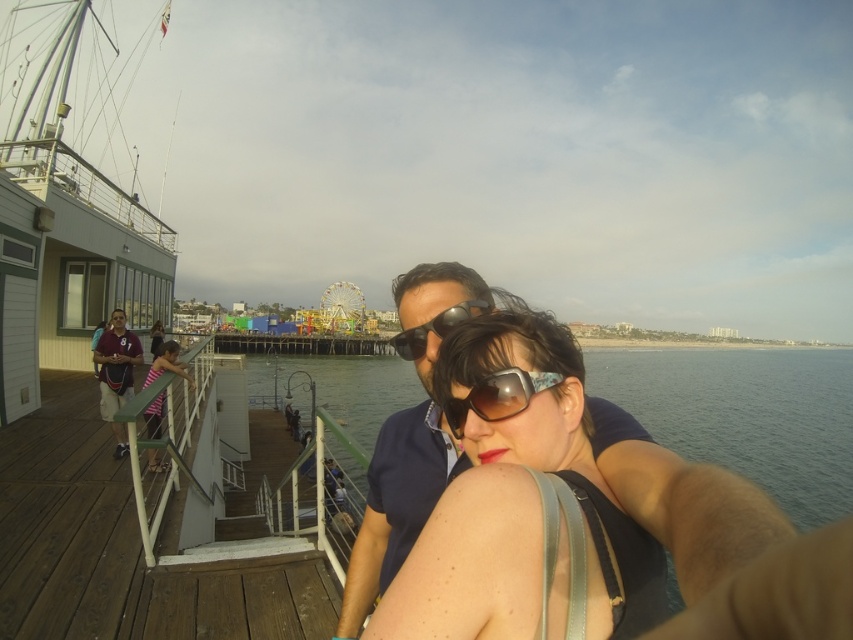
Question: Which point is farther to the camera?

Choices:
 (A) [x=99, y=371]
 (B) [x=450, y=342]

Answer: (A)

Question: Which point is closer to the camera?

Choices:
 (A) brown wooden deck at lower left
 (B) black plastic sunglasses at center
 (C) maroon jersey at left

Answer: (A)

Question: Is matte black tank top at center positioned at the back of sunglasses at center?

Choices:
 (A) yes
 (B) no

Answer: (B)

Question: Which object is positioned closest to the sunglasses at center?

Choices:
 (A) maroon jersey at left
 (B) clear blue water at center
 (C) matte blue shirt at left
 (D) black plastic sunglasses at center

Answer: (D)

Question: Considering the relative positions of brown wooden deck at lower left and sunglasses at center in the image provided, where is brown wooden deck at lower left located with respect to sunglasses at center?

Choices:
 (A) above
 (B) below

Answer: (B)

Question: Does matte blue shirt at left appear on the right side of maroon jersey at left?

Choices:
 (A) yes
 (B) no

Answer: (A)